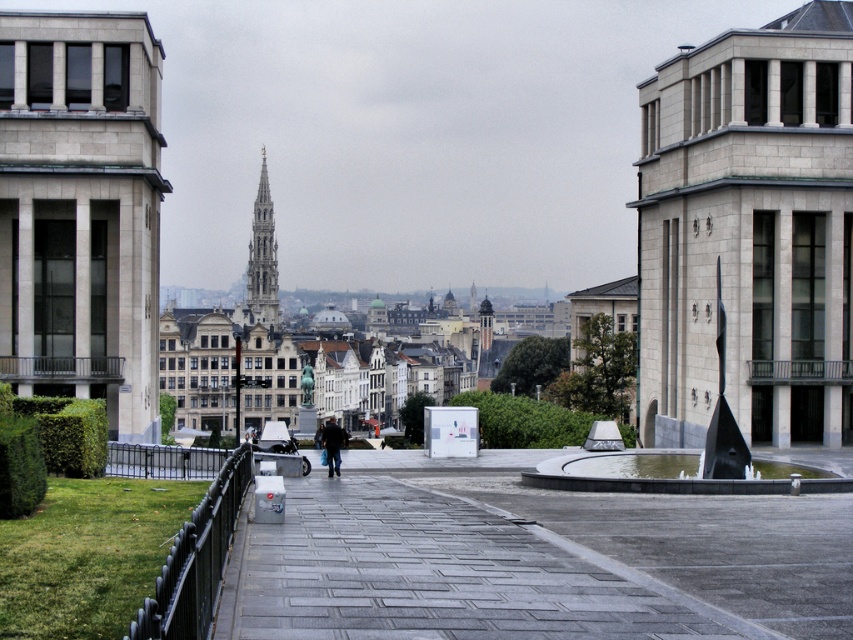
Question: Which of the following is the closest to the observer?

Choices:
 (A) gray stone sculpture at right
 (B) light gray stone tower at left

Answer: (B)

Question: Among these objects, which one is farthest from the camera?

Choices:
 (A) gray stone sculpture at right
 (B) dark blue jeans at center

Answer: (A)

Question: Which object is the closest to the dark blue jeans at center?

Choices:
 (A) light gray stone tower at left
 (B) smooth stone spire at center
 (C) gray stone sculpture at right
 (D) gray concrete pavement at center

Answer: (A)

Question: Is gray concrete pavement at center further to camera compared to smooth stone spire at center?

Choices:
 (A) no
 (B) yes

Answer: (A)

Question: Does gray concrete pavement at center lie in front of smooth stone spire at center?

Choices:
 (A) yes
 (B) no

Answer: (A)

Question: Observing the image, what is the correct spatial positioning of gray concrete pavement at center in reference to smooth stone spire at center?

Choices:
 (A) below
 (B) above

Answer: (A)